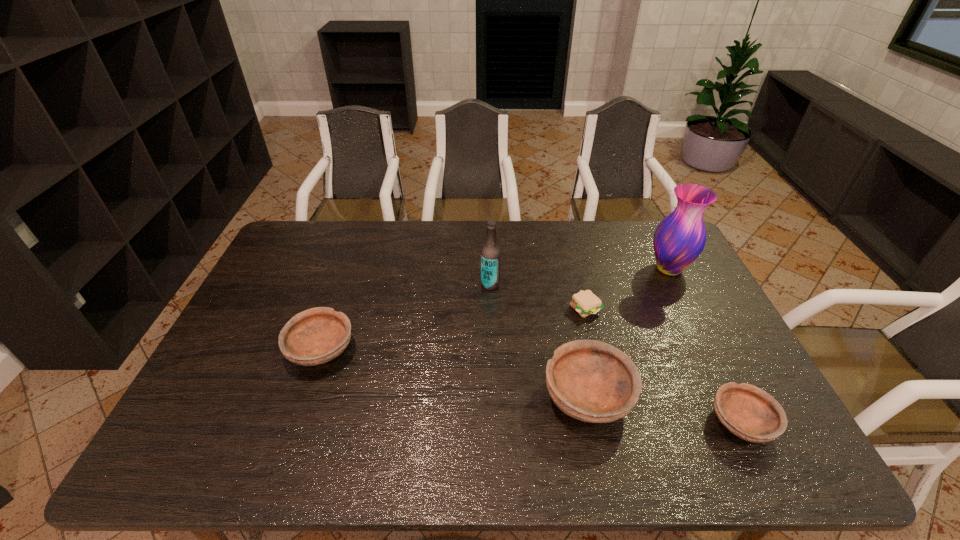
The width and height of the screenshot is (960, 540). What are the coordinates of `blank space that satisfies the following two spatial constraints: 1. on the side of the fifth shortest object with the label; 2. on the left side of the second shortest object` in the screenshot? It's located at (494, 423).

Where is `vacant area that satisfies the following two spatial constraints: 1. on the back side of the third farthest object; 2. on the right side of the tallest object`? vacant area that satisfies the following two spatial constraints: 1. on the back side of the third farthest object; 2. on the right side of the tallest object is located at coordinates (576, 269).

Where is `vacant space that satisfies the following two spatial constraints: 1. on the front side of the leftmost object; 2. on the right side of the tallest bowl`? vacant space that satisfies the following two spatial constraints: 1. on the front side of the leftmost object; 2. on the right side of the tallest bowl is located at coordinates (305, 396).